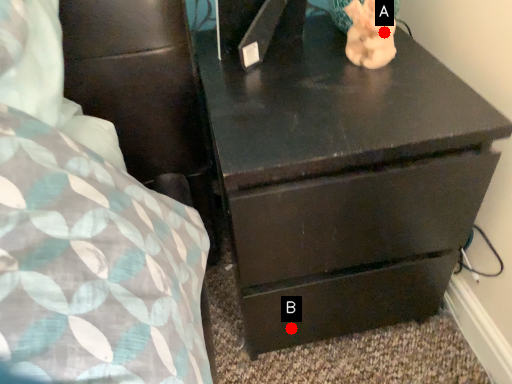
Question: Two points are circled on the image, labeled by A and B beside each circle. Which of the following is the closest to the observer?

Choices:
 (A) A is closer
 (B) B is closer

Answer: (A)